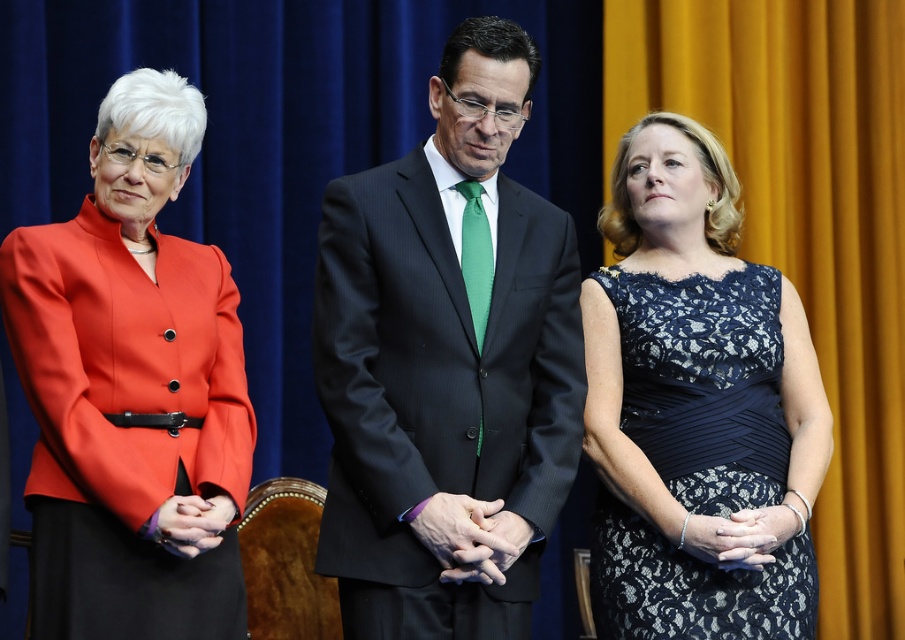
Is silver metallic bracelet at center to the left of matte black hands at center from the viewer's perspective?

In fact, silver metallic bracelet at center is to the right of matte black hands at center.

Is point (729, 522) closer to viewer compared to point (172, 531)?

No, it is behind (172, 531).

Identify the location of silver metallic bracelet at center. (731, 538).

Who is higher up, smooth skin hands at center or matte black hands at center?

Positioned higher is matte black hands at center.

Looking at this image, is smooth skin hands at center shorter than matte black hands at center?

No.

Identify the location of smooth skin hands at center. (470, 536).

Between lace fabric dress at center and smooth skin hands at center, which one is positioned higher?

lace fabric dress at center

Who is more forward, (x=655, y=566) or (x=529, y=540)?

Point (x=529, y=540) is in front.

You are a GUI agent. You are given a task and a screenshot of the screen. Output one action in this format:
    pyautogui.click(x=<x>, y=<y>)
    Task: Click on the lace fabric dress at center
    The height and width of the screenshot is (640, 905).
    Given the screenshot: What is the action you would take?
    pyautogui.click(x=703, y=384)